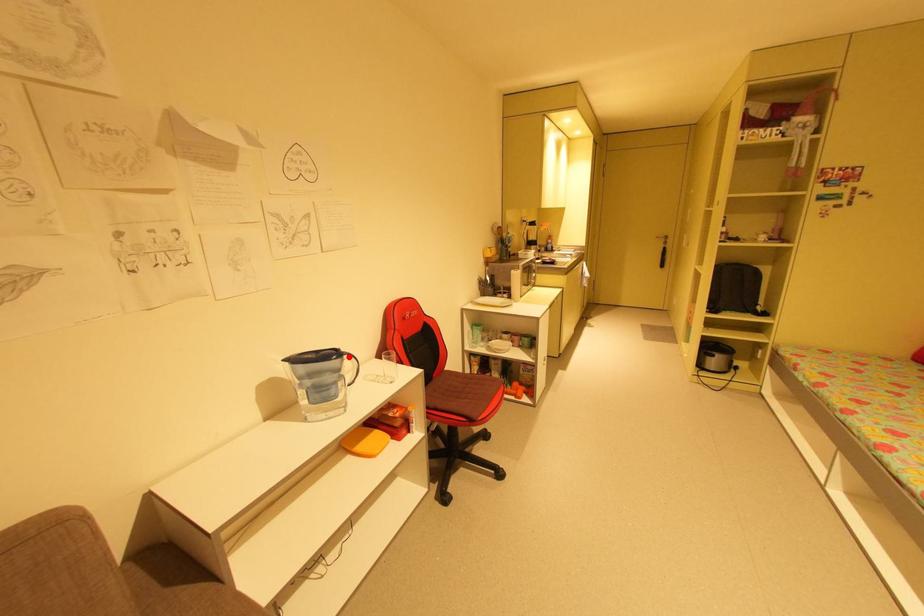
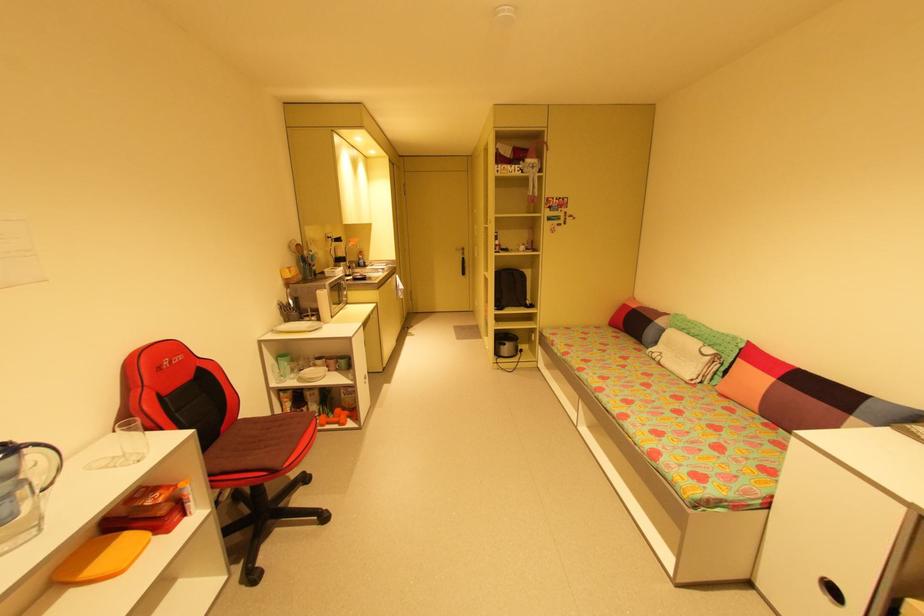
The point at the highlighted location is marked in the first image. Where is the corresponding point in the second image?

(30, 450)